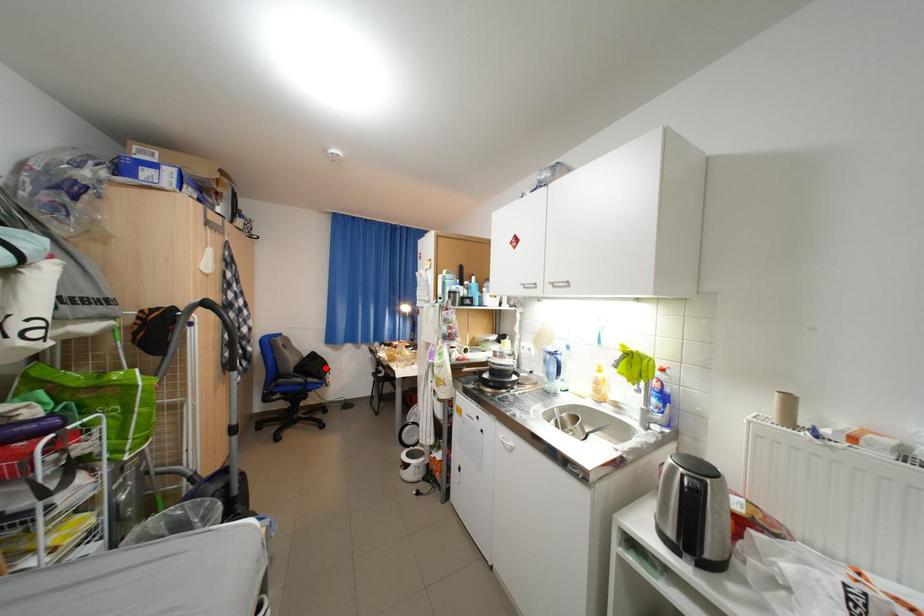
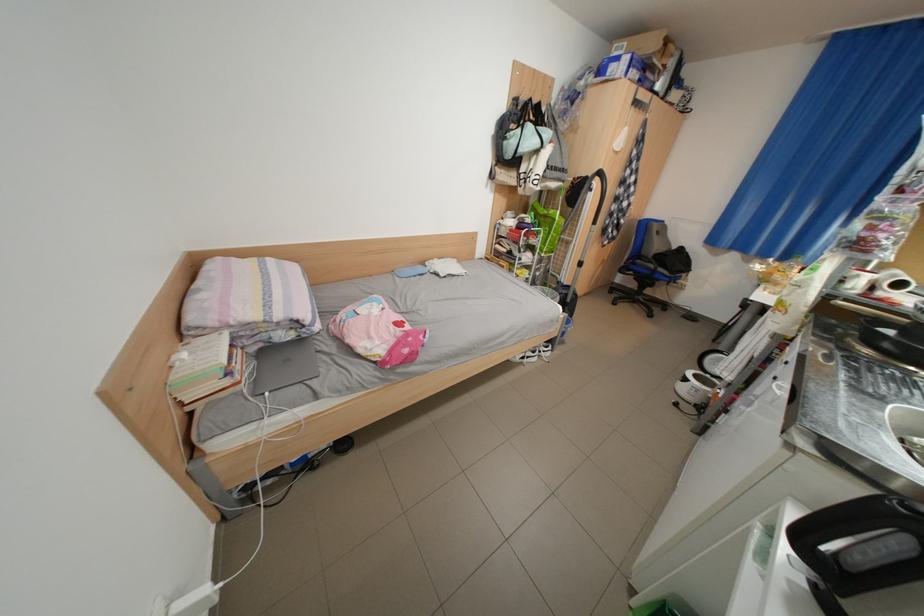
In the second image, find the point that corresponds to the highlighted location in the first image.

(687, 264)